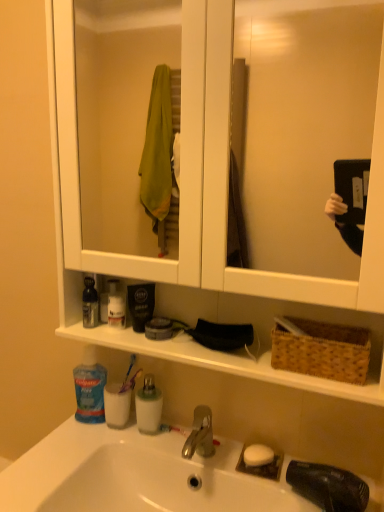
Identify the location of space that is in front of white opaque cup at lower left, the first mouthwash from the bottom. Image resolution: width=384 pixels, height=512 pixels. (93, 451).